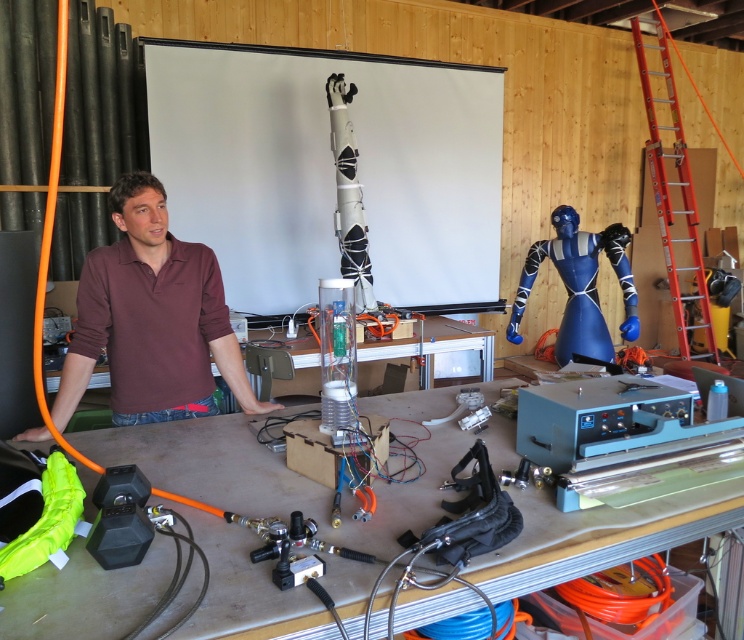
You are a technician needing to place a 1.5 meter long tool on the workspace. Can both ends of the tool fit entirely on the metallic gray table at center and the matte plastic table at center if placed between them?

The metallic gray table at center and the matte plastic table at center are 1.53 meters apart. Since the tool is 1.5 meters long, it can fit between them with 3 centimeters of extra space.

You are a guest entering the workshop and want to place a small tool on the metallic gray table at center. To do so, you must first navigate around the white matte projection screen at upper center. Which object should you move past first?

You should move past the white matte projection screen at upper center first because the metallic gray table at center is located behind it.

You are a visitor in the workshop and want to find the matte plastic table at center. Where should you look relative to the maroon cotton polo shirt at center?

The matte plastic table at center is to the right of the maroon cotton polo shirt at center.